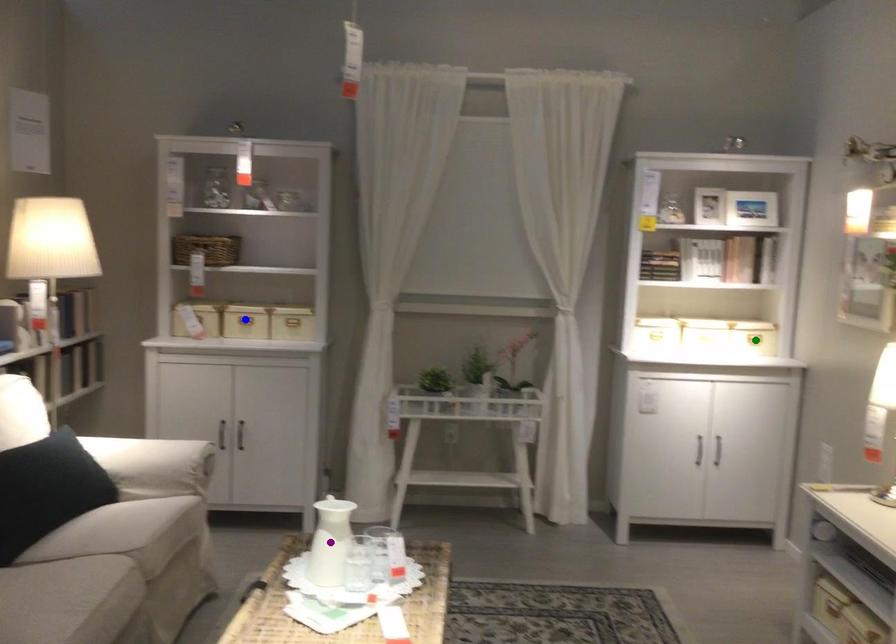
Order these from nearest to farthest:
A) purple point
B) blue point
C) green point

1. purple point
2. green point
3. blue point